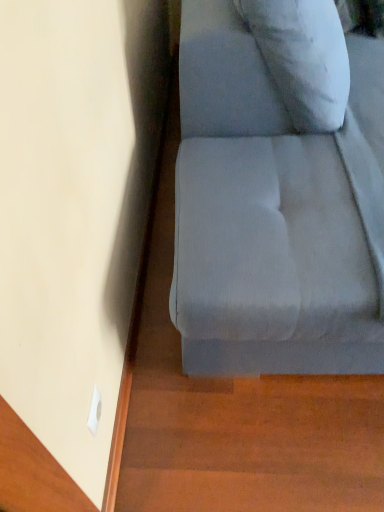
The width and height of the screenshot is (384, 512). Describe the element at coordinates (276, 207) in the screenshot. I see `light gray fabric couch at center` at that location.

Locate an element on the screen. The height and width of the screenshot is (512, 384). light gray fabric couch at center is located at coordinates (276, 207).

Identify the location of light gray fabric couch at center. point(276,207).